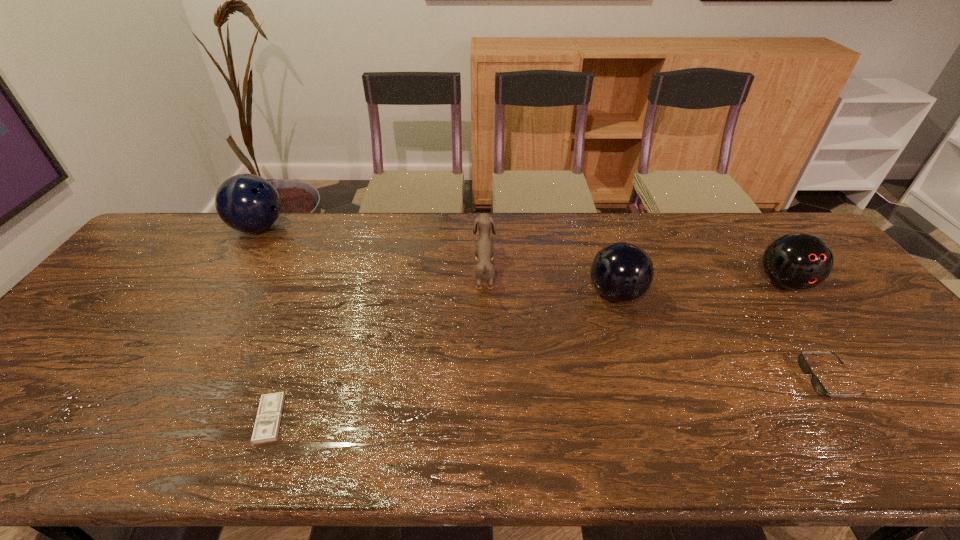
You are a GUI agent. You are given a task and a screenshot of the screen. Output one action in this format:
    pyautogui.click(x=<x>, y=<y>)
    Task: Click on the free space between the leftmost bowling ball and the sunglasses
    
    Given the screenshot: What is the action you would take?
    pyautogui.click(x=544, y=303)

Find the location of a particular element. The image size is (960, 540). free spot between the shortest object and the rightmost bowling ball is located at coordinates (527, 351).

Where is `unoccupied area between the money and the leftmost object`? This screenshot has width=960, height=540. unoccupied area between the money and the leftmost object is located at coordinates (264, 323).

At what (x,y) coordinates should I click in order to perform the action: click on free spot between the puppy and the sunglasses. Please return your answer as a coordinate pair (x, y). The width and height of the screenshot is (960, 540). Looking at the image, I should click on (657, 325).

Locate an element on the screen. vacant point located between the rightmost bowling ball and the third object from right to left is located at coordinates (700, 288).

Find the location of a particular element. The height and width of the screenshot is (540, 960). free area in between the puppy and the second bowling ball from right to left is located at coordinates (550, 282).

Find the location of a particular element. vacant area that lies between the second bowling ball from left to right and the second object from left to right is located at coordinates (443, 356).

This screenshot has width=960, height=540. I want to click on vacant point located between the puppy and the money, so click(377, 345).

Identify which object is located as the third nearest to the second shortest object. Please provide its 2D coordinates. Your answer should be formatted as a tuple, i.e. [(x, y)], where the tuple contains the x and y coordinates of a point satisfying the conditions above.

[(484, 249)]

Locate an element on the screen. The image size is (960, 540). the fourth closest object to the rightmost bowling ball is located at coordinates (268, 418).